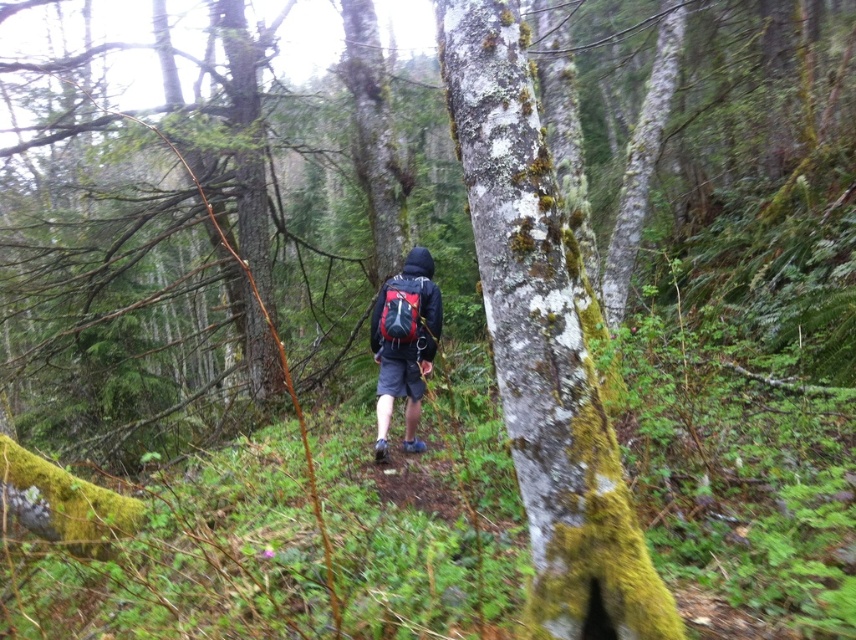
Question: Which point is closer to the camera?

Choices:
 (A) (405, 419)
 (B) (562, 360)

Answer: (B)

Question: Where is matte black jacket at center located in relation to matte black backpack at center in the image?

Choices:
 (A) right
 (B) left

Answer: (B)

Question: Observing the image, what is the correct spatial positioning of matte black jacket at center in reference to matte black backpack at center?

Choices:
 (A) below
 (B) above

Answer: (A)

Question: Which point is farther from the camera taking this photo?

Choices:
 (A) (373, 333)
 (B) (407, 332)
 (C) (574, 540)

Answer: (A)

Question: Where is matte black jacket at center located in relation to matte black backpack at center in the image?

Choices:
 (A) above
 (B) below

Answer: (B)

Question: Which object appears farthest from the camera in this image?

Choices:
 (A) matte black jacket at center
 (B) matte black backpack at center

Answer: (A)